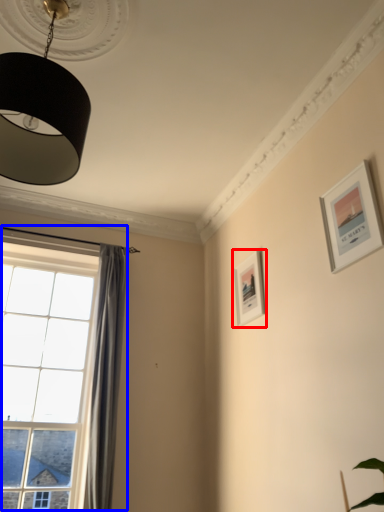
Question: Which point is further to the camera, picture frame (highlighted by a red box) or window (highlighted by a blue box)?

Choices:
 (A) picture frame
 (B) window

Answer: (A)